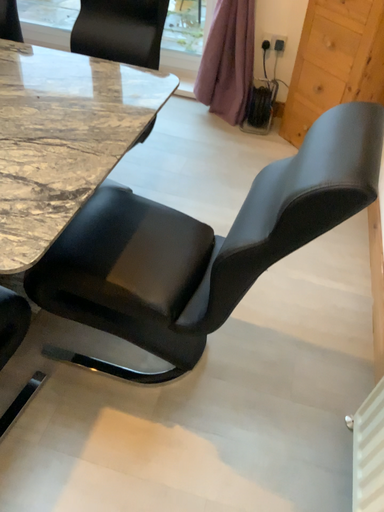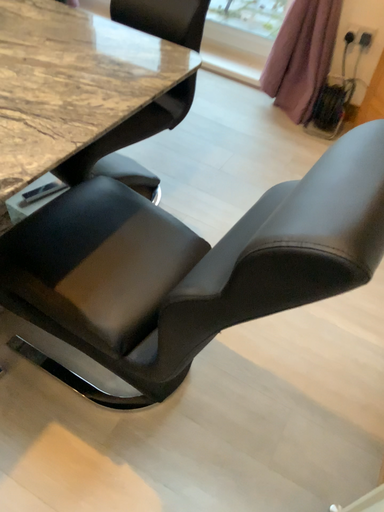
Question: Which way did the camera rotate in the video?

Choices:
 (A) rotated right
 (B) rotated left

Answer: (B)